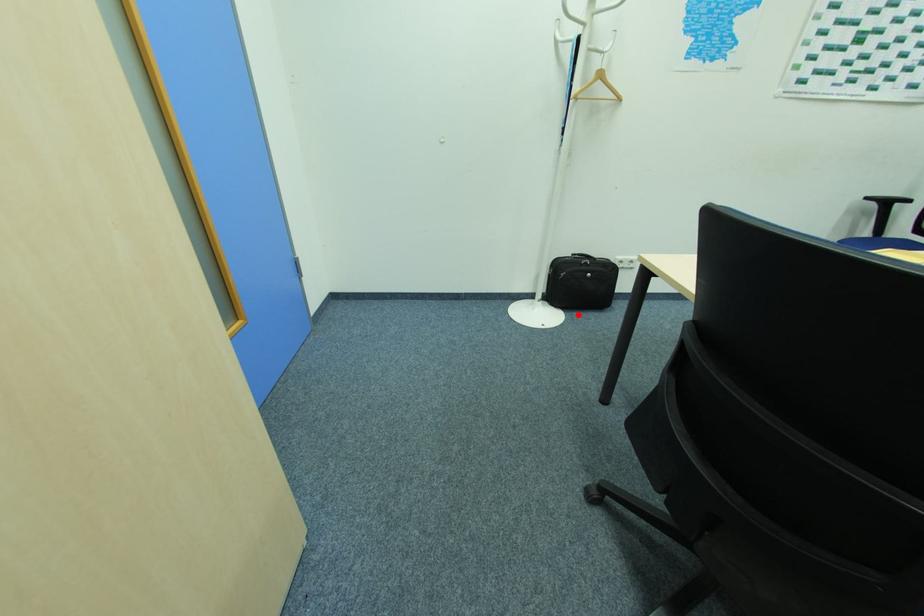
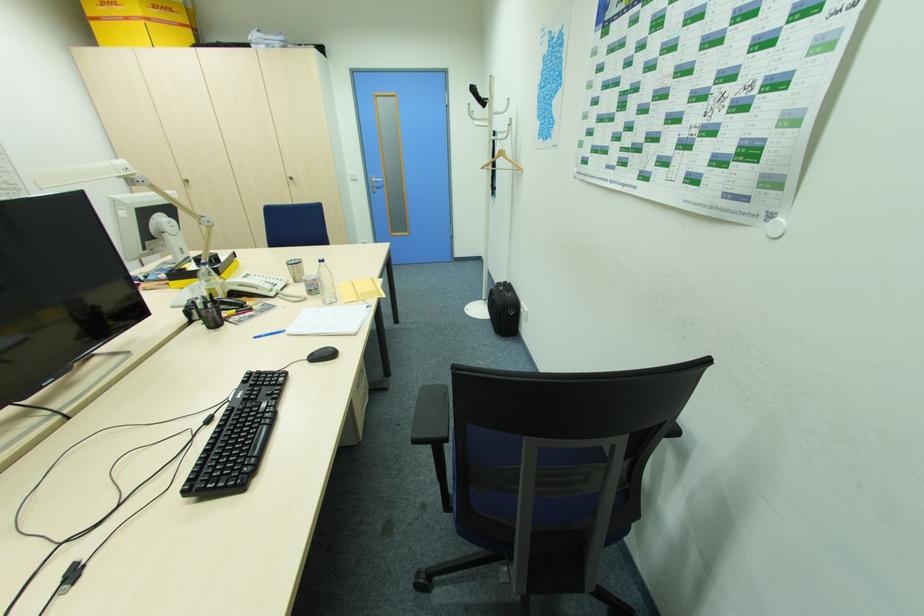
The point at the highlighted location is marked in the first image. Where is the corresponding point in the second image?

(492, 325)